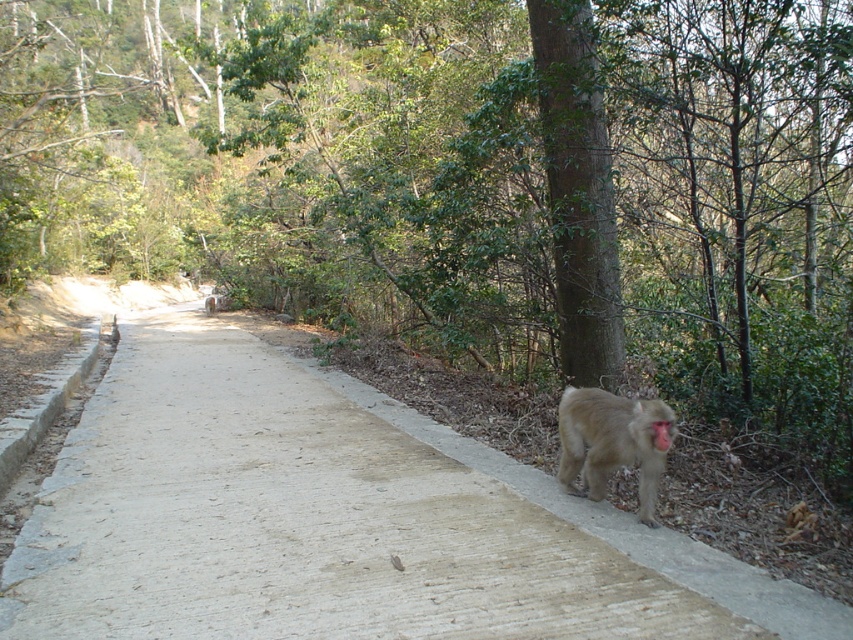
You are a hiker walking on the gray concrete pavement at center. You see a pink fur monkey at lower right nearby. Can you estimate if the pavement is wide enough for you to walk past the monkey without stepping off the path?

The gray concrete pavement at center is wider than the pink fur monkey at lower right, so yes, the pavement is wide enough for you to walk past the monkey without stepping off the path.

You are a hiker walking along the gray concrete pavement at center and see the pink fur monkey at lower right nearby. Which direction should you turn to face the monkey?

The gray concrete pavement at center is to the left of the pink fur monkey at lower right, so you should turn to your right to face the monkey.

You are standing at the center of the paved pathway in the forest scene. You see a gray fur monkey at lower right. Where is the gray fur monkey located relative to your position?

The gray fur monkey at lower right is located at the lower right position relative to your viewpoint.